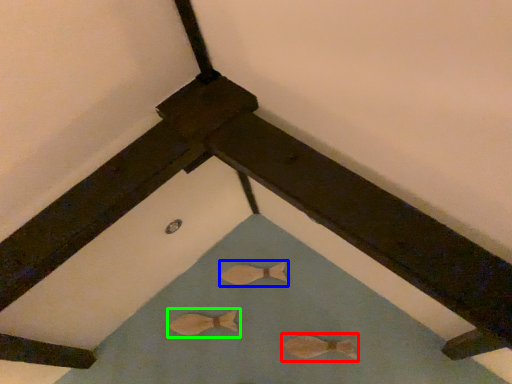
Question: Which object is positioned closest to animal (highlighted by a red box)? Select from animal (highlighted by a blue box) and animal (highlighted by a green box).

Choices:
 (A) animal
 (B) animal

Answer: (A)